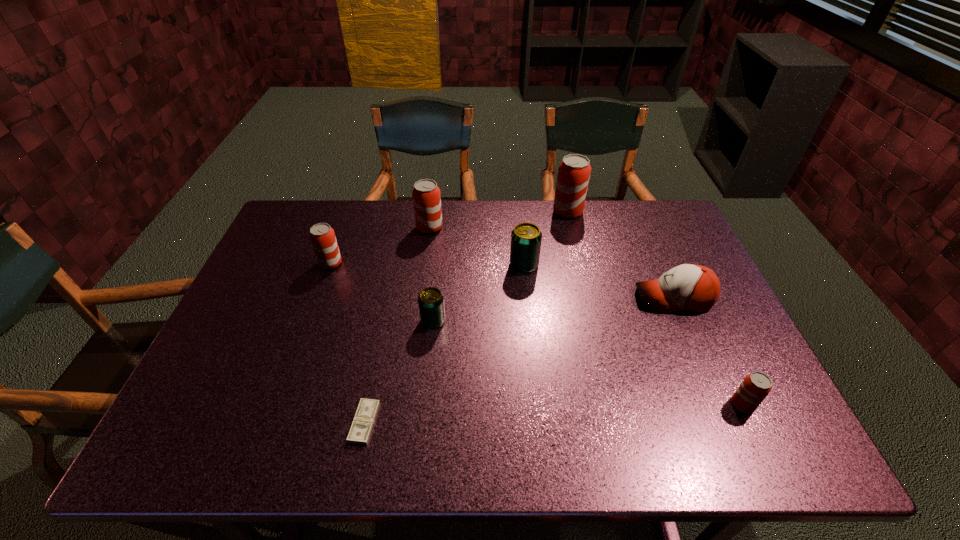
You are a GUI agent. You are given a task and a screenshot of the screen. Output one action in this format:
    pyautogui.click(x=<x>, y=<y>)
    Task: Click on the left green beer can
    The width and height of the screenshot is (960, 540).
    Given the screenshot: What is the action you would take?
    pyautogui.click(x=430, y=300)

Locate an element on the screen. the rightmost orange beer can is located at coordinates (755, 387).

Locate an element on the screen. This screenshot has width=960, height=540. the nearest beer can is located at coordinates (755, 387).

Locate an element on the screen. This screenshot has width=960, height=540. money is located at coordinates (361, 428).

This screenshot has width=960, height=540. Identify the location of the second object from left to right. (361, 428).

Locate an element on the screen. This screenshot has width=960, height=540. vacant space located 0.200m on the left of the tallest beer can is located at coordinates (495, 212).

In order to click on vacant point located on the front of the second tallest object in this screenshot , I will do `click(423, 276)`.

The height and width of the screenshot is (540, 960). Find the location of `free space located on the front of the leftmost orange beer can`. free space located on the front of the leftmost orange beer can is located at coordinates (300, 346).

This screenshot has height=540, width=960. I want to click on vacant space situated on the left of the fourth object from right to left, so click(388, 265).

This screenshot has height=540, width=960. Find the location of `vacant point located on the front-facing side of the baseball cap`. vacant point located on the front-facing side of the baseball cap is located at coordinates (535, 298).